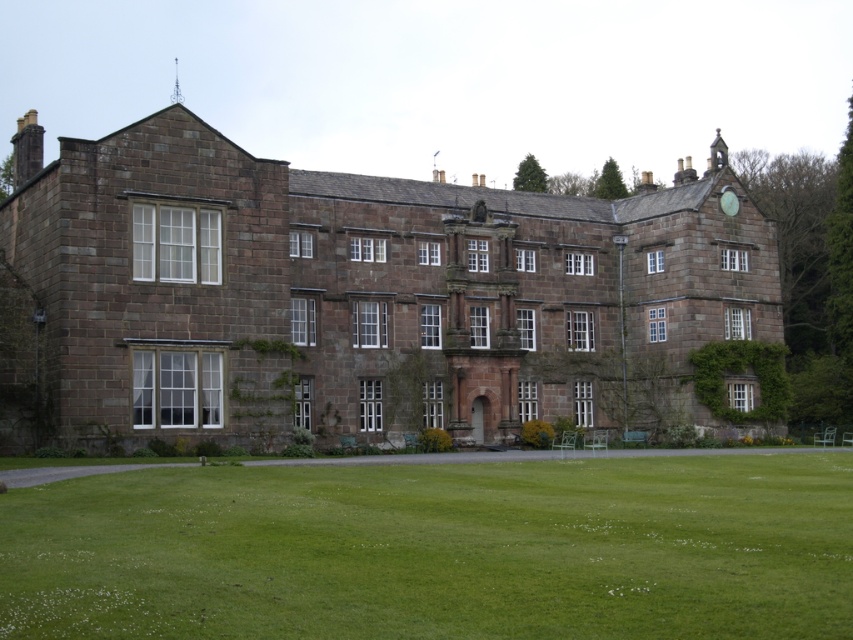
Question: Which point is closer to the camera?

Choices:
 (A) (15, 400)
 (B) (732, 538)

Answer: (B)

Question: Which object is farther from the camera taking this photo?

Choices:
 (A) green grass at lower center
 (B) brown stone mansion at center

Answer: (B)

Question: Can you confirm if brown stone mansion at center is smaller than green grass at lower center?

Choices:
 (A) yes
 (B) no

Answer: (B)

Question: Where is brown stone mansion at center located in relation to green grass at lower center in the image?

Choices:
 (A) above
 (B) below

Answer: (A)

Question: Which point is closer to the camera?

Choices:
 (A) brown stone mansion at center
 (B) green grass at lower center

Answer: (B)

Question: Is brown stone mansion at center above green grass at lower center?

Choices:
 (A) no
 (B) yes

Answer: (B)